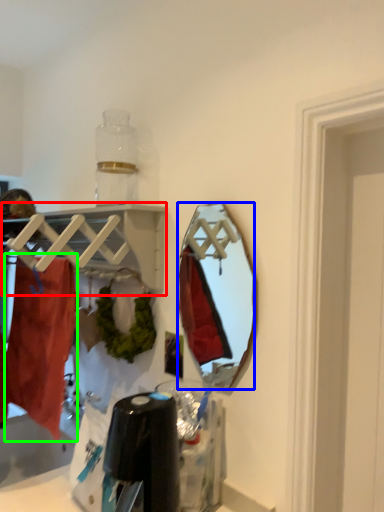
Question: Considering the real-world distances, which object is farthest from shelf (highlighted by a red box)? mirror (highlighted by a blue box) or clothing (highlighted by a green box)?

Choices:
 (A) mirror
 (B) clothing

Answer: (A)